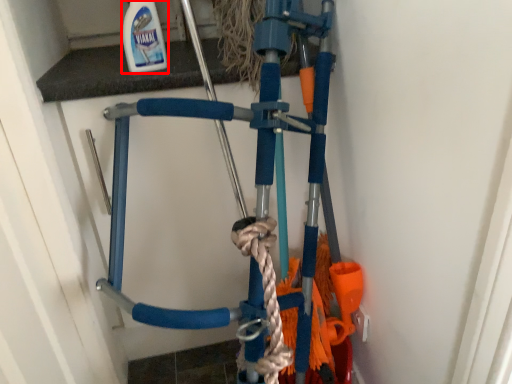
Question: From the image's perspective, considering the relative positions of cleaning product (annotated by the red box) and bicycle in the image provided, where is cleaning product (annotated by the red box) located with respect to the staircase?

Choices:
 (A) below
 (B) above

Answer: (B)